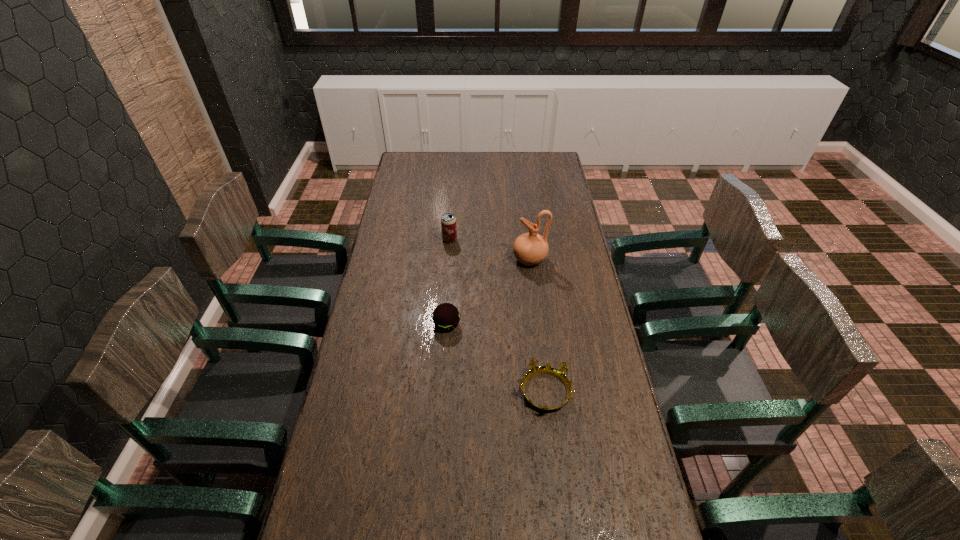
Find the location of a particular element. pottery is located at coordinates (530, 248).

At what (x,y) coordinates should I click in order to perform the action: click on the tallest object. Please return your answer as a coordinate pair (x, y). Looking at the image, I should click on (530, 248).

This screenshot has width=960, height=540. In order to click on the farthest object in this screenshot , I will do `click(448, 221)`.

This screenshot has height=540, width=960. Find the location of `the second tallest object`. the second tallest object is located at coordinates (448, 221).

This screenshot has width=960, height=540. In order to click on the third tallest object in this screenshot , I will do `click(446, 317)`.

Where is `patty`? patty is located at coordinates (446, 317).

In order to click on the shortest object in this screenshot , I will do `click(560, 373)`.

Where is `crown`? The image size is (960, 540). crown is located at coordinates (560, 373).

In order to click on free space located 0.350m on the spout of the tallest object in this screenshot , I will do `click(427, 260)`.

At what (x,y) coordinates should I click in order to perform the action: click on vacant region located on the spout of the tallest object. Please return your answer as a coordinate pair (x, y). The image size is (960, 540). Looking at the image, I should click on (466, 260).